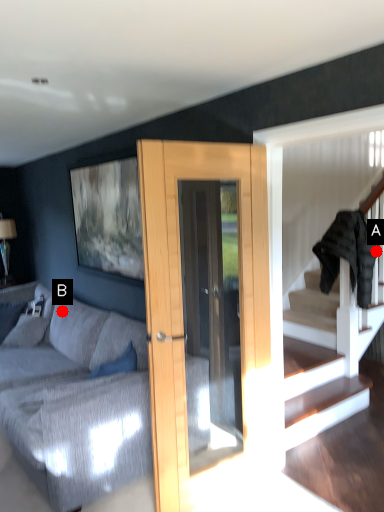
Question: Two points are circled on the image, labeled by A and B beside each circle. Which point appears farthest from the camera in this image?

Choices:
 (A) A is further
 (B) B is further

Answer: (B)